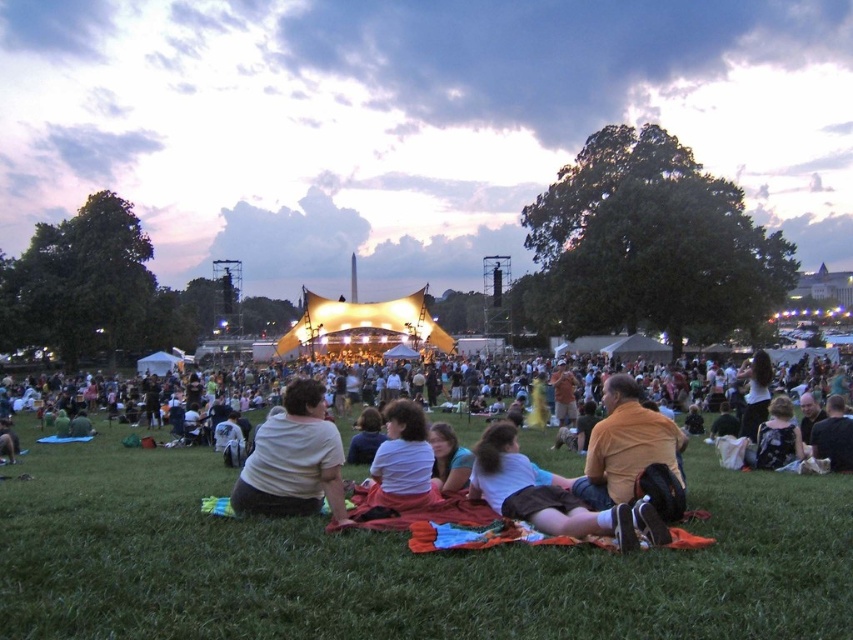
Which of these two, orange cotton shirt at lower center or orange cotton shirt at center, stands taller?

orange cotton shirt at center is taller.

Is point (473, 461) closer to viewer compared to point (614, 419)?

No, it is not.

Does point (498, 483) lie in front of point (578, 483)?

Yes.

The image size is (853, 640). I want to click on orange cotton shirt at lower center, so click(550, 497).

Does orange cotton shirt at center have a smaller size compared to printed floral dress at lower right?

No.

Between point (618, 467) and point (770, 416), which one is positioned behind?

Point (770, 416)

Between point (637, 456) and point (770, 426), which one is positioned in front?

Point (637, 456) is in front.

Where is `orange cotton shirt at center`? orange cotton shirt at center is located at coordinates (625, 445).

Is green grass at center wider than light brown hair at center?

Yes, green grass at center is wider than light brown hair at center.

Between green grass at center and light brown hair at center, which one has more height?

With more height is green grass at center.

Where is `green grass at center`? Image resolution: width=853 pixels, height=640 pixels. green grass at center is located at coordinates (397, 563).

Find the location of a particular element. green grass at center is located at coordinates (397, 563).